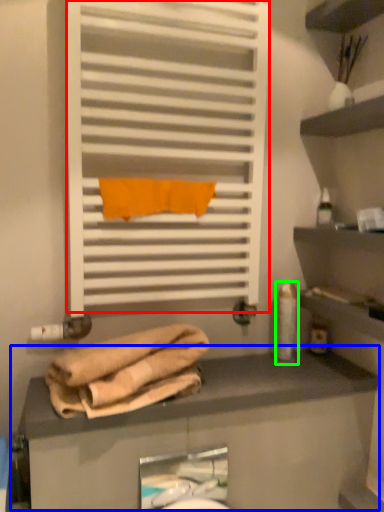
Question: Considering the real-world distances, which object is farthest from shutter (highlighted by a red box)? counter (highlighted by a blue box) or toiletry (highlighted by a green box)?

Choices:
 (A) counter
 (B) toiletry

Answer: (A)